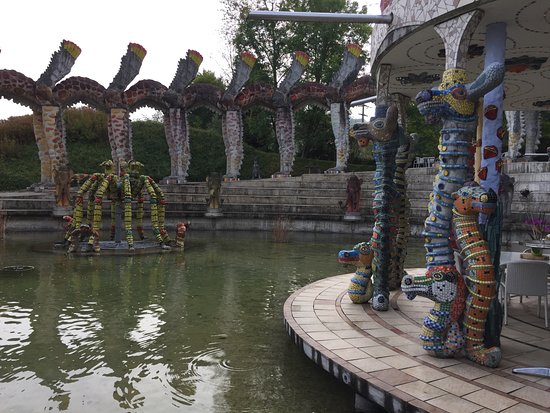
Find the location of a particular element. The image size is (550, 413). decorative animal like designs and statues is located at coordinates (473, 249), (440, 228), (442, 278), (385, 221), (361, 250).